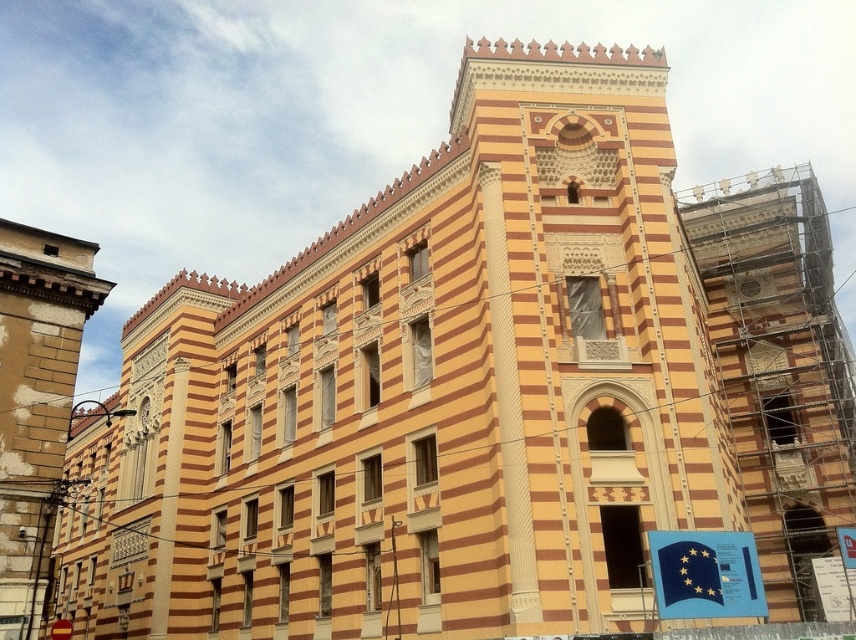
You are a construction worker who needs to move a tool from the scaffolding at right to the blue paper flag at lower right. Given that the tool is 2 meters long, can you safely carry it horizontally between these two points without bending it?

The distance between the scaffolding at right and blue paper flag at lower right is 23.53 meters. Since the tool is only 2 meters long, you can safely carry it horizontally between these two points without bending it.

Consider the image. You are standing at point A located at coordinates point A at (759, 298). You want to walk to point B, which is 63.21 meters away. Given that the building has a symmetrical facade with repeating vertical stripes, can you estimate how many stripes you would pass while walking from point A to point B?

The distance between point A at (759, 298) and point B is 63.21 meters. Since the building has a symmetrical facade with repeating vertical stripes, you would pass approximately 63.21 meters divided by the width of each stripe. However, without knowing the exact width of each stripe, an exact number cannot be determined. The question might be incomplete or missing information about stripe dimensions.

Consider the image. You are a painter who needs to paint both the scaffolding at right and the metallic gold clock at upper right. Which object requires a wider brush to paint its entire width in a single stroke?

The scaffolding at right might be wider than metallic gold clock at upper right, so the painter would need a wider brush for the scaffolding at right to cover its entire width in one stroke.